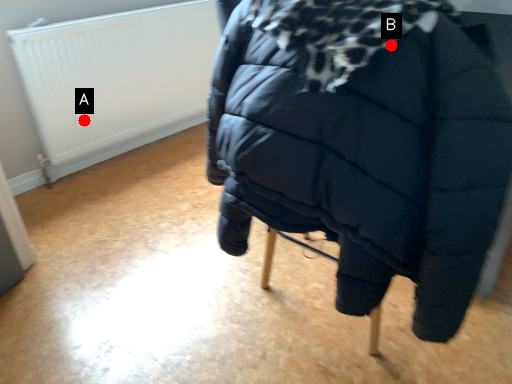
Question: Two points are circled on the image, labeled by A and B beside each circle. Which point is closer to the camera taking this photo?

Choices:
 (A) A is closer
 (B) B is closer

Answer: (B)